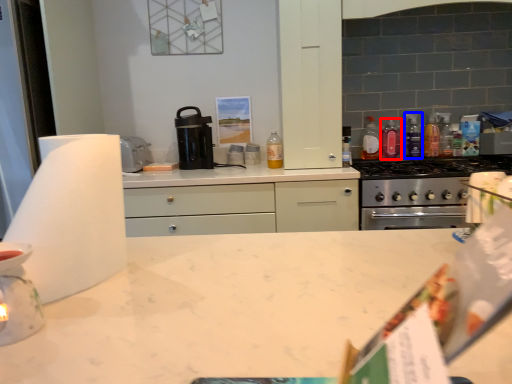
Question: Which of the following is the farthest to the observer, bottle (highlighted by a red box) or bottle (highlighted by a blue box)?

Choices:
 (A) bottle
 (B) bottle

Answer: (A)